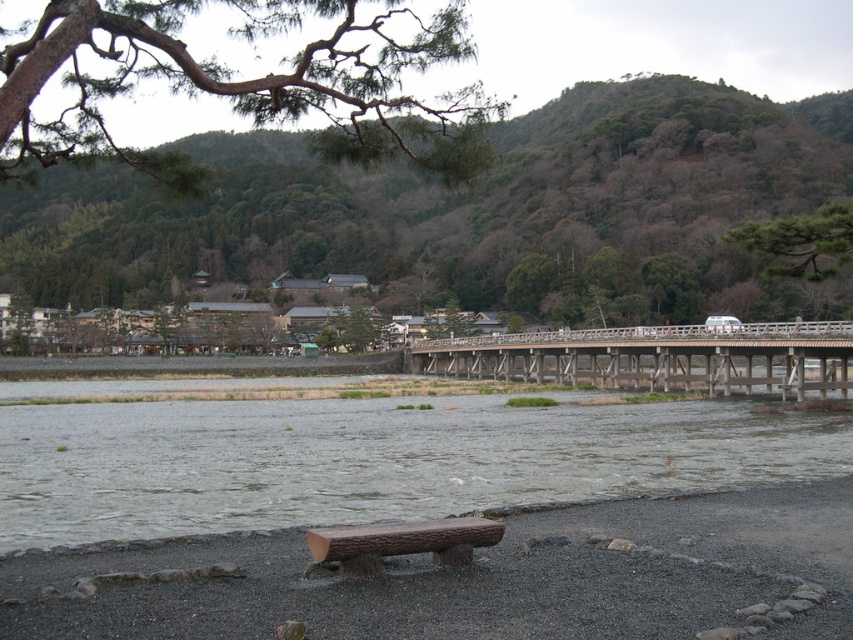
You are standing on the traditional wooden bridge and looking towards the upper part of the image. Which object, the green leafy branch at upper left or the green textured pine tree at upper right, is closer to you?

The green leafy branch at upper left is closer to you because it is in front of the green textured pine tree at upper right.